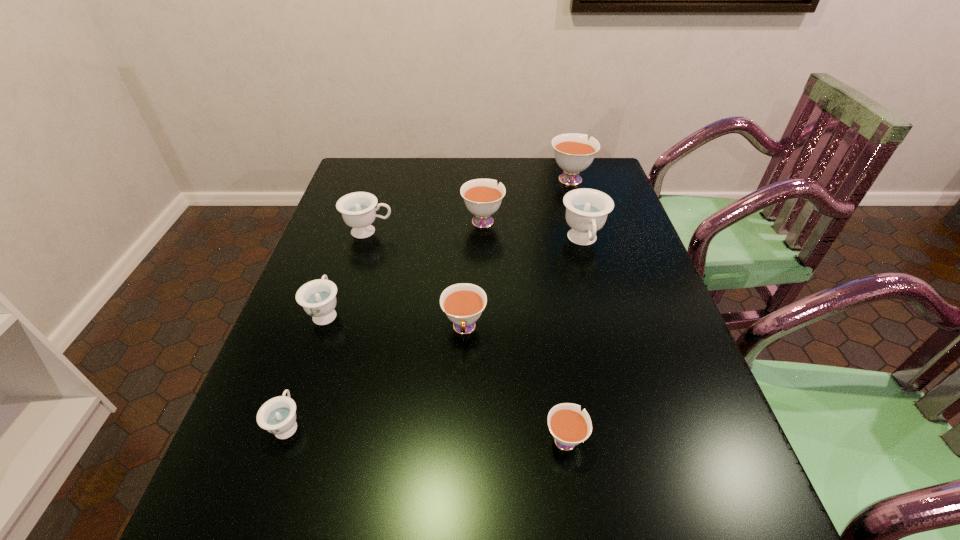
Locate an element on the screen. This screenshot has width=960, height=540. the farthest object is located at coordinates (573, 153).

Find the location of `the biggest white teacup`. the biggest white teacup is located at coordinates (573, 153).

I want to click on the rightmost blue teacup, so click(x=586, y=209).

Identify the location of the third smallest white teacup. The height and width of the screenshot is (540, 960). (482, 197).

This screenshot has width=960, height=540. Identify the location of the third smallest blue teacup. (358, 210).

Identify the location of the third biggest white teacup. (463, 303).

I want to click on the second smallest blue teacup, so click(x=318, y=297).

You are a GUI agent. You are given a task and a screenshot of the screen. Output one action in this format:
    pyautogui.click(x=<x>, y=<y>)
    Task: Click on the smallest white teacup
    
    Given the screenshot: What is the action you would take?
    pyautogui.click(x=569, y=426)

In order to click on the third object from right to left in this screenshot , I will do `click(569, 426)`.

Where is `the nearest blue teacup`? This screenshot has height=540, width=960. the nearest blue teacup is located at coordinates (278, 415).